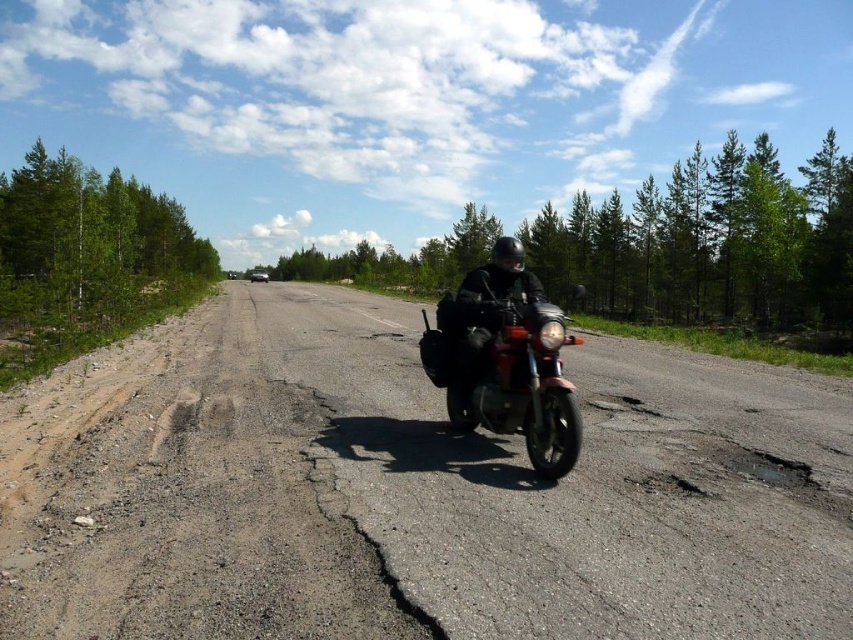
What do you see at coordinates (511, 376) in the screenshot? I see `shiny chrome motorcycle at center` at bounding box center [511, 376].

Consider the image. Does shiny chrome motorcycle at center lie behind matte black motorcycle at center?

No, it is in front of matte black motorcycle at center.

Find the location of `shiny chrome motorcycle at center`. shiny chrome motorcycle at center is located at coordinates (511, 376).

Does dirtgravel/soiltrack at left come behind matte black motorcycle at center?

No, it is in front of matte black motorcycle at center.

Does dirtgravel/soiltrack at left have a lesser height compared to matte black motorcycle at center?

Yes.

At what (x,y) coordinates should I click in order to perform the action: click on dirtgravel/soiltrack at left. Please return your answer as a coordinate pair (x, y). Looking at the image, I should click on (412, 492).

Describe the element at coordinates (412, 492) in the screenshot. I see `dirtgravel/soiltrack at left` at that location.

Between dirtgravel/soiltrack at left and shiny chrome motorcycle at center, which one has more height?

Standing taller between the two is shiny chrome motorcycle at center.

Which is behind, point (4, 419) or point (527, 406)?

Positioned behind is point (4, 419).

Where is `dirtgravel/soiltrack at left`? Image resolution: width=853 pixels, height=640 pixels. dirtgravel/soiltrack at left is located at coordinates (412, 492).